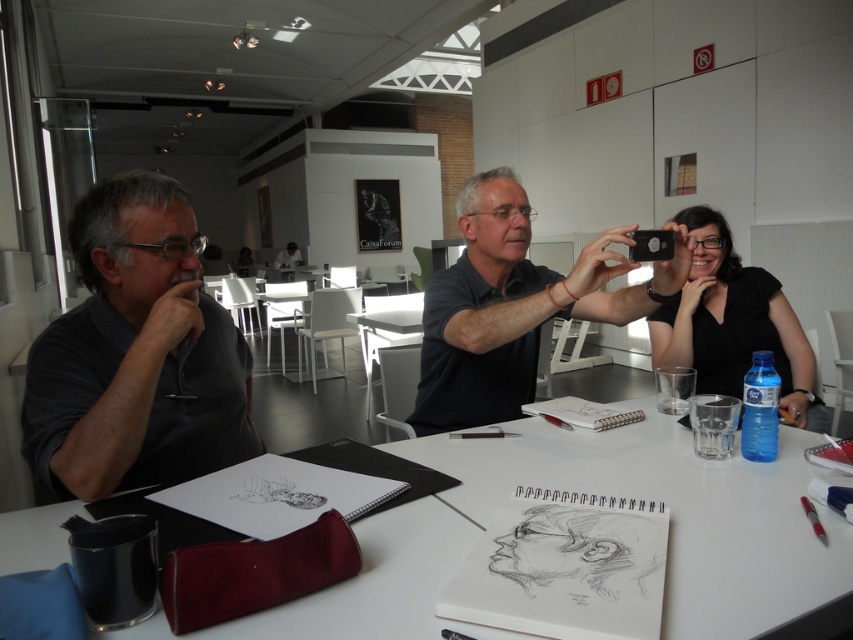
Which is above, dark gray shirt at left or black matte shirt at upper right?

black matte shirt at upper right

Is dark gray shirt at left to the right of black matte shirt at upper right from the viewer's perspective?

Incorrect, dark gray shirt at left is not on the right side of black matte shirt at upper right.

Image resolution: width=853 pixels, height=640 pixels. Identify the location of dark gray shirt at left. (136, 353).

Image resolution: width=853 pixels, height=640 pixels. Find the location of `dark gray shirt at left`. dark gray shirt at left is located at coordinates (136, 353).

Does matte black phone at center have a greater height compared to black matte shirt at upper right?

Yes.

Describe the element at coordinates (514, 305) in the screenshot. I see `matte black phone at center` at that location.

This screenshot has height=640, width=853. I want to click on matte black phone at center, so click(x=514, y=305).

Is white paper at center bigger than black matte shirt at upper right?

Indeed, white paper at center has a larger size compared to black matte shirt at upper right.

Is point (538, 477) positioned after point (723, 365)?

No, (538, 477) is in front of (723, 365).

Find the location of a particular element. The height and width of the screenshot is (640, 853). white paper at center is located at coordinates (598, 492).